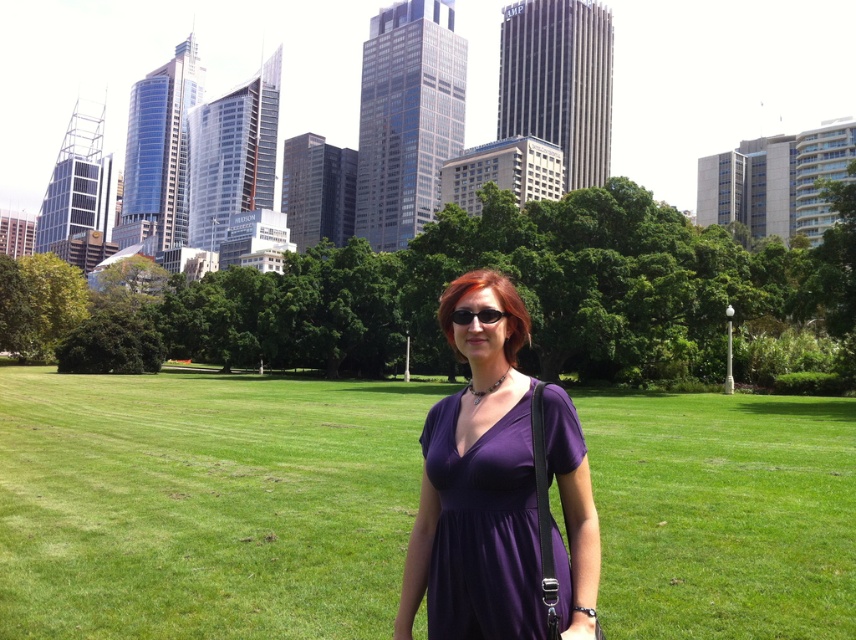
What do you see at coordinates (497, 490) in the screenshot?
I see `purple matte dress at center` at bounding box center [497, 490].

Which is more to the right, purple matte dress at center or black plastic sunglasses at center?

black plastic sunglasses at center

Is point (520, 304) positioned after point (484, 317)?

Yes, it is.

The image size is (856, 640). What are the coordinates of `purple matte dress at center` in the screenshot? It's located at 497,490.

Who is positioned more to the right, purple fabric dress at center or black plastic sunglasses at center?

black plastic sunglasses at center is more to the right.

Which of these two, purple fabric dress at center or black plastic sunglasses at center, stands taller?

purple fabric dress at center is taller.

Locate an element on the screen. The height and width of the screenshot is (640, 856). purple fabric dress at center is located at coordinates (204, 502).

Does point (394, 449) come closer to viewer compared to point (486, 448)?

That is False.

Who is lower down, purple fabric dress at center or purple matte dress at center?

purple fabric dress at center is lower down.

Is point (176, 588) farther from viewer compared to point (516, 321)?

Yes, it is.

This screenshot has height=640, width=856. I want to click on purple fabric dress at center, so pyautogui.click(x=204, y=502).